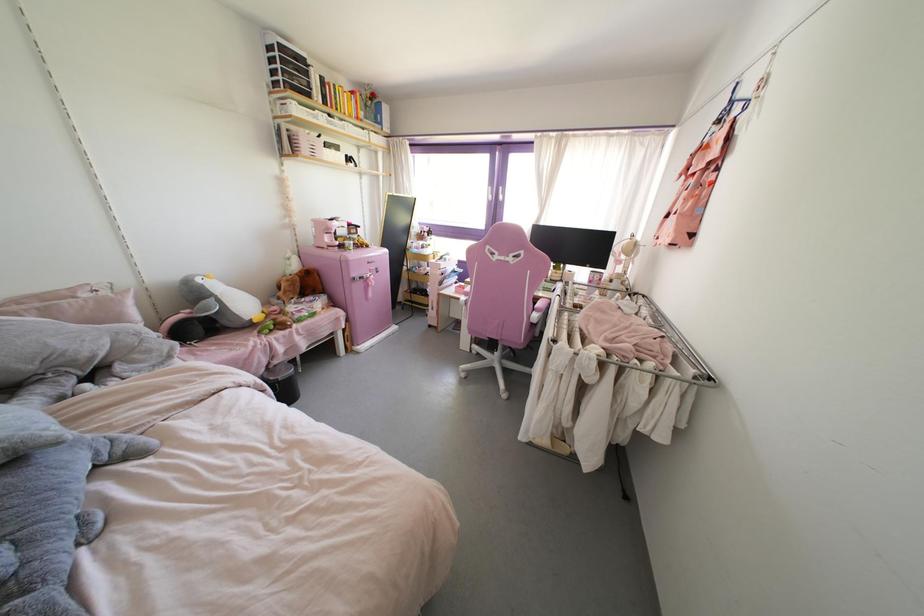
The image size is (924, 616). In order to click on pink refrigerator handle in this screenshot , I will do `click(367, 281)`.